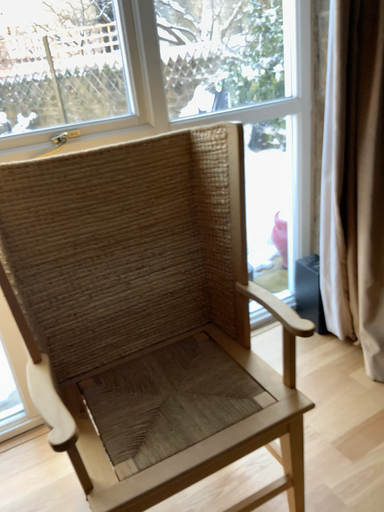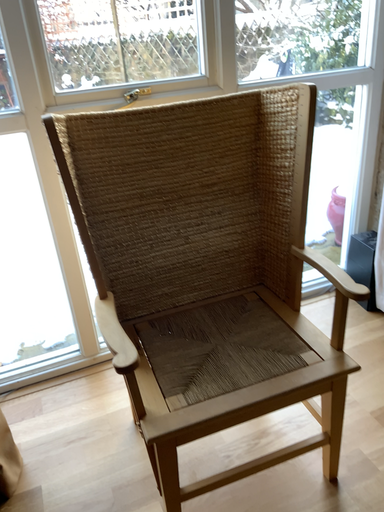
Question: Which way did the camera rotate in the video?

Choices:
 (A) rotated left
 (B) rotated right

Answer: (A)